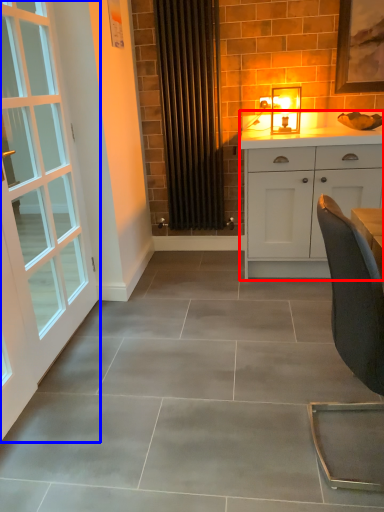
Question: Which object appears closest to the camera in this image, cabinetry (highlighted by a red box) or door (highlighted by a blue box)?

Choices:
 (A) cabinetry
 (B) door

Answer: (B)